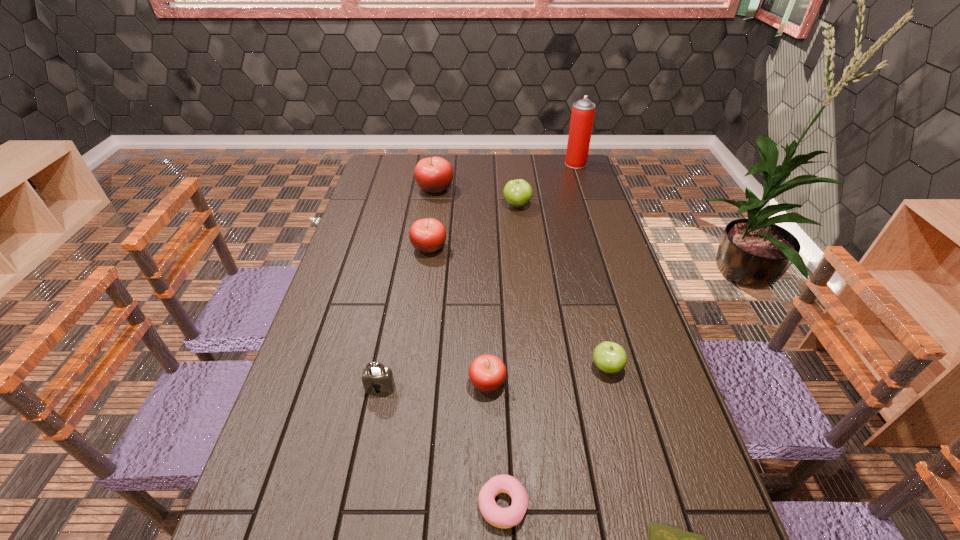
At what (x,y) coordinates should I click in order to perform the action: click on free space located on the back of the smaller green apple. Please return your answer as a coordinate pair (x, y). Looking at the image, I should click on coord(594,318).

Where is `vacant region located on the back of the smallest red apple`? vacant region located on the back of the smallest red apple is located at coordinates (486, 286).

Where is `free point located on the left of the pink doughnut`? free point located on the left of the pink doughnut is located at coordinates (448, 504).

Locate an element on the screen. Image resolution: width=960 pixels, height=540 pixels. aerosol can that is at the far edge is located at coordinates (583, 111).

Find the location of a particular element. Image resolution: width=960 pixels, height=540 pixels. apple that is at the far edge is located at coordinates (434, 175).

The width and height of the screenshot is (960, 540). I want to click on aerosol can at the right edge, so click(x=583, y=111).

Identify the location of apple at the right edge. Image resolution: width=960 pixels, height=540 pixels. (609, 357).

You are a GUI agent. You are given a task and a screenshot of the screen. Output one action in this format:
    pyautogui.click(x=<x>, y=<y>)
    Task: Click on the object located in the far right corner section of the desktop
    The width and height of the screenshot is (960, 540).
    Given the screenshot: What is the action you would take?
    pyautogui.click(x=583, y=111)

In the image, there is a desktop. Where is `vacant space at the far edge`? vacant space at the far edge is located at coordinates (548, 172).

In the image, there is a desktop. Where is `vacant space at the left edge`? This screenshot has height=540, width=960. vacant space at the left edge is located at coordinates (385, 223).